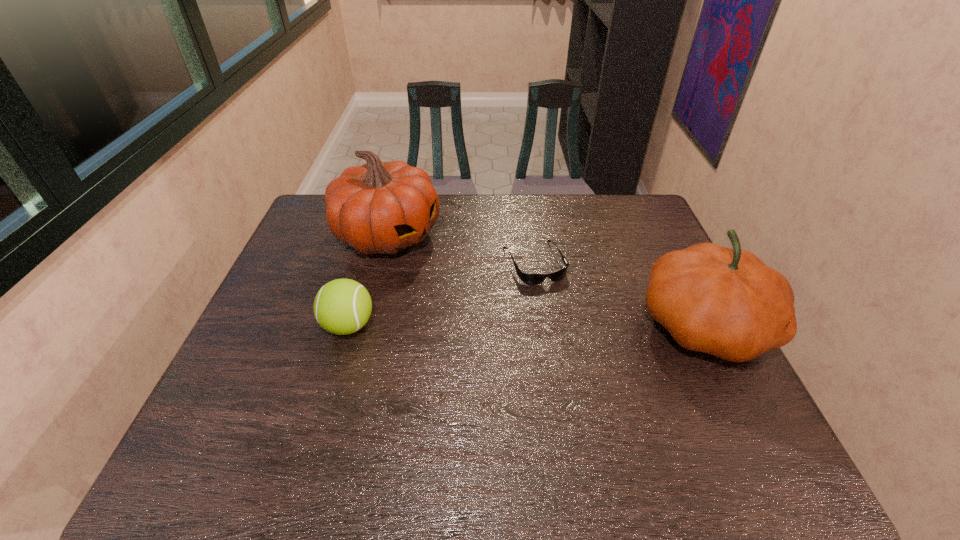
Find the location of `blank space at the right edge of the desktop`. blank space at the right edge of the desktop is located at coordinates (698, 371).

The width and height of the screenshot is (960, 540). In the image, there is a desktop. Find the location of `vacant space at the far right corner`. vacant space at the far right corner is located at coordinates (614, 225).

In the image, there is a desktop. In order to click on vacant area at the near right corner in this screenshot , I will do `click(729, 421)`.

Locate an element on the screen. free space between the third tallest object and the farther pumpkin is located at coordinates (369, 280).

Find the location of a particular element. free space between the tennis ball and the rightmost object is located at coordinates 527,325.

The image size is (960, 540). I want to click on free spot between the third tallest object and the left pumpkin, so [x=369, y=280].

The height and width of the screenshot is (540, 960). What are the coordinates of `empty location between the farther pumpkin and the shortest object` in the screenshot? It's located at (461, 249).

At what (x,y) coordinates should I click in order to perform the action: click on free space between the sunglasses and the rightmost object. Please return your answer as a coordinate pair (x, y). Image resolution: width=960 pixels, height=540 pixels. Looking at the image, I should click on (619, 294).

You are a GUI agent. You are given a task and a screenshot of the screen. Output one action in this format:
    pyautogui.click(x=<x>, y=<y>)
    Task: Click on the vacant space in between the third object from left to right and the third tallest object
    Image resolution: width=960 pixels, height=540 pixels.
    Given the screenshot: What is the action you would take?
    pyautogui.click(x=442, y=294)

Locate an element on the screen. This screenshot has height=540, width=960. free space between the third tallest object and the right pumpkin is located at coordinates (527, 325).